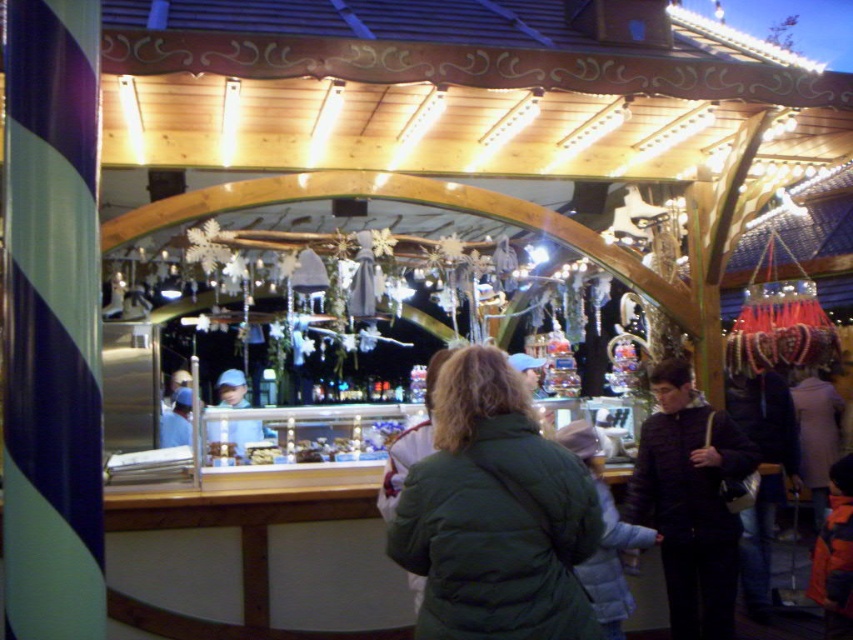
At what (x,y) coordinates should I click in order to perform the action: click on green quilted jacket at center. Please return your answer as a coordinate pair (x, y). This screenshot has height=640, width=853. Looking at the image, I should click on (494, 515).

Between green quilted jacket at center and dark green quilted jacket at center, which one has more height?

With more height is green quilted jacket at center.

Describe the element at coordinates (494, 515) in the screenshot. The width and height of the screenshot is (853, 640). I see `green quilted jacket at center` at that location.

Locate an element on the screen. Image resolution: width=853 pixels, height=640 pixels. green quilted jacket at center is located at coordinates (494, 515).